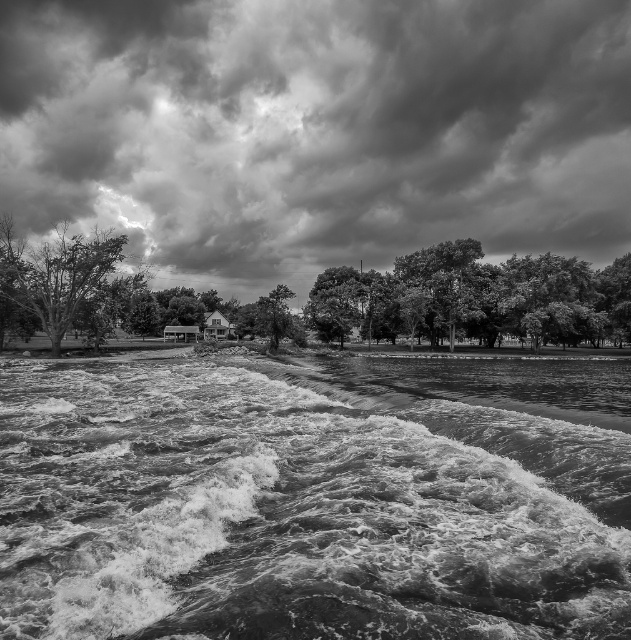
Question: Can you confirm if rough water at lower center is thinner than dark green leafy tree at center?

Choices:
 (A) yes
 (B) no

Answer: (A)

Question: Can you confirm if rough water at lower center is bigger than smooth bark tree at left?

Choices:
 (A) yes
 (B) no

Answer: (B)

Question: Is rough water at lower center thinner than cloudy sky at upper center?

Choices:
 (A) yes
 (B) no

Answer: (A)

Question: Which object appears closest to the camera in this image?

Choices:
 (A) dark green leafy tree at center
 (B) smooth green trees at center
 (C) smooth bark tree at left
 (D) cloudy sky at upper center

Answer: (C)

Question: Which point is closer to the camera?

Choices:
 (A) (274, 317)
 (B) (598, 13)

Answer: (A)

Question: Which of the following is the farthest from the observer?

Choices:
 (A) (495, 298)
 (B) (463, 179)
 (C) (567, 314)

Answer: (B)